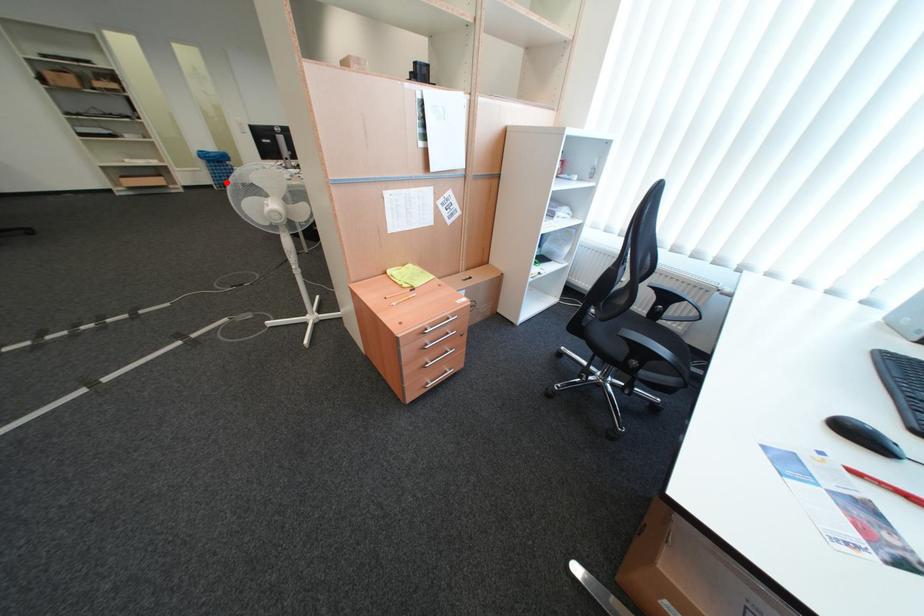
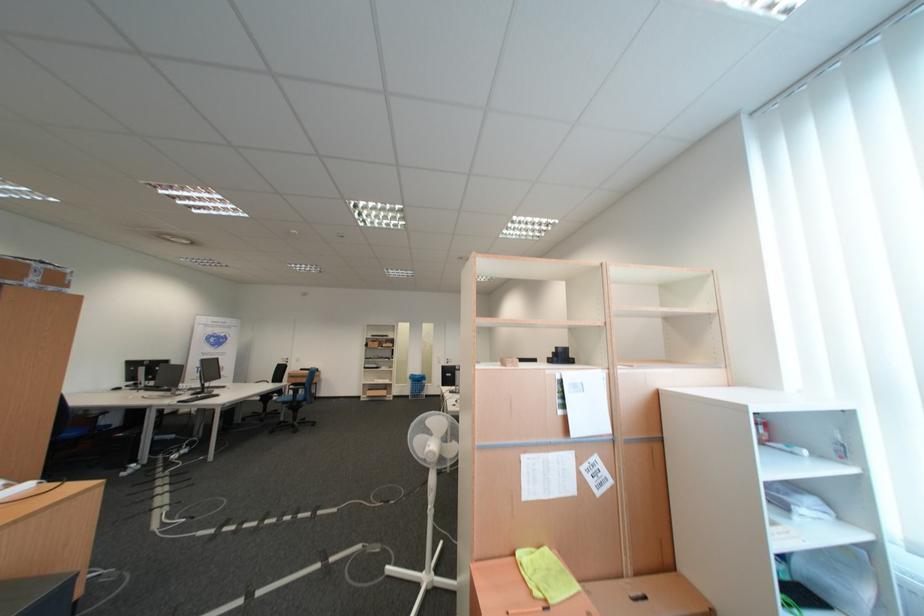
Question: I am providing you with two images of the same scene from different viewpoints. Image1 has a red point marked. In image2, the corresponding 3D location appears at what relative position? Reply with the corresponding letter.

Choices:
 (A) Closer
 (B) Farther

Answer: (A)